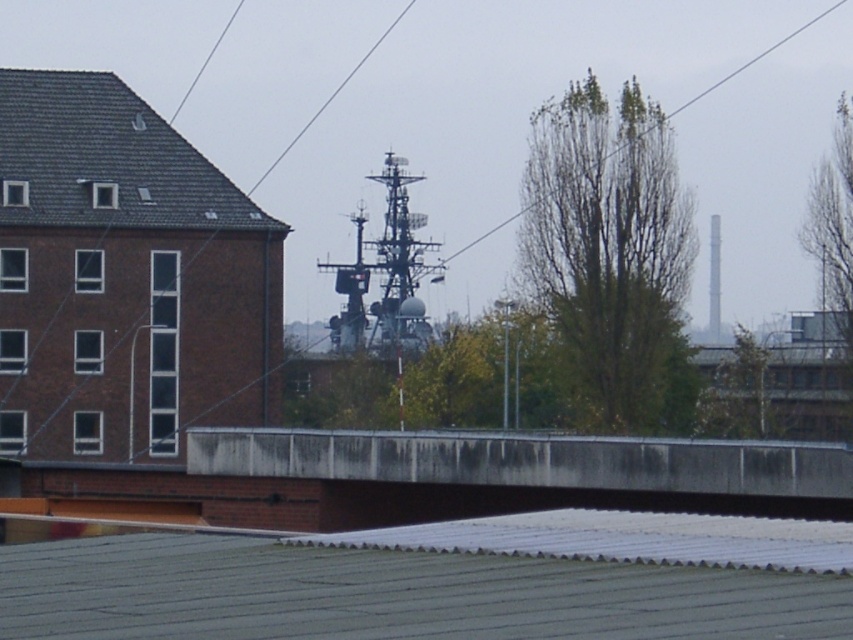
You are an urban planner reviewing this area. You need to determine if the dark gray shingles at upper left and the metallic wire at upper center are overlapping in the image. Based on the scene, can you confirm if one is in front of the other?

Yes, the dark gray shingles at upper left is in front of the metallic wire at upper center, so they are overlapping in the image.

You are standing at a viewpoint overlooking the urban scene described. There is a specific point marked at coordinates point (x=90, y=221). If you want to place a 100 feet long safety barrier between you and this point to ensure safety, will the barrier be sufficient to cover the distance?

The distance of point (x=90, y=221) from viewer is 303.95 feet. The safety barrier is only 100 feet long, which is shorter than the required distance. Therefore, the barrier will not be sufficient to cover the distance.

You are an architect assessing the height of two elements in the scene. The dark gray shingles at upper left and the metallic wire at upper center. Which one is taller?

The metallic wire at upper center is taller than the dark gray shingles at upper left.